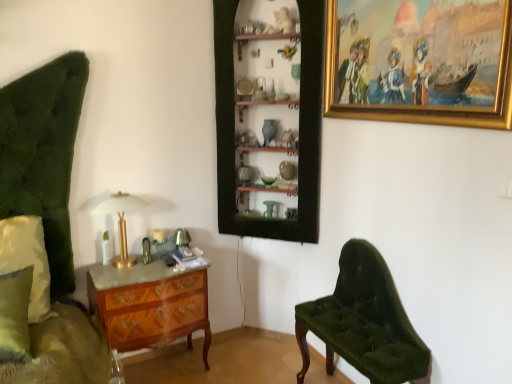
Where is `unoccupied region to the right of wooden marquetry chest of drawers at lower left`? The width and height of the screenshot is (512, 384). unoccupied region to the right of wooden marquetry chest of drawers at lower left is located at coordinates (237, 360).